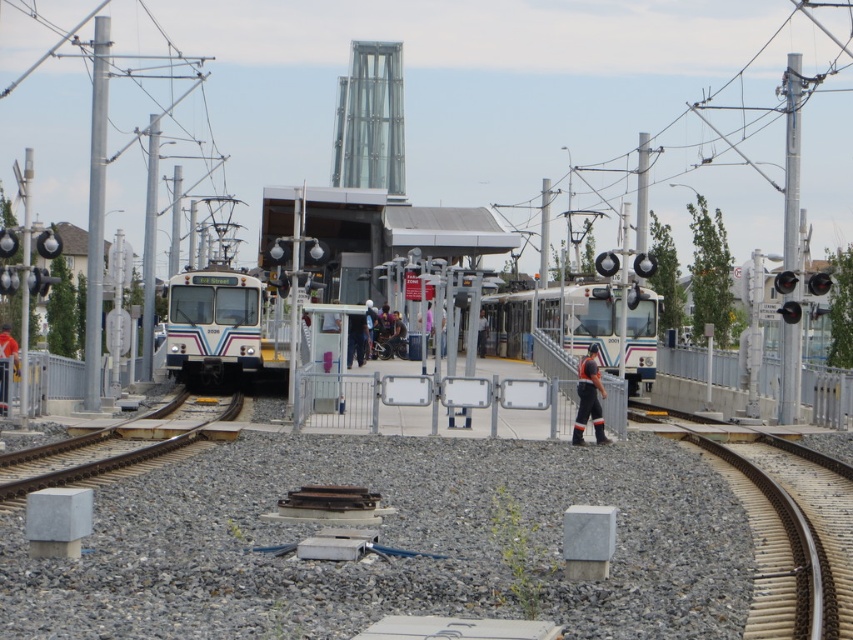
The image size is (853, 640). What do you see at coordinates (213, 326) in the screenshot?
I see `white glossy passenger train at center` at bounding box center [213, 326].

Where is `white glossy passenger train at center`? white glossy passenger train at center is located at coordinates (213, 326).

Image resolution: width=853 pixels, height=640 pixels. What do you see at coordinates (213, 326) in the screenshot?
I see `white glossy passenger train at center` at bounding box center [213, 326].

Between white glossy passenger train at center and orange reflective pants at center, which one has less height?

With less height is orange reflective pants at center.

Between point (248, 332) and point (579, 376), which one is positioned behind?

Point (248, 332)

In order to click on white glossy passenger train at center in this screenshot , I will do point(213,326).

Identify the location of white glossy train at center. (556, 321).

Does white glossy train at center appear over white shirt at center?

Yes.

Which is in front, point (502, 353) or point (485, 333)?

Point (502, 353) is more forward.

The width and height of the screenshot is (853, 640). Find the location of `white glossy train at center`. white glossy train at center is located at coordinates (556, 321).